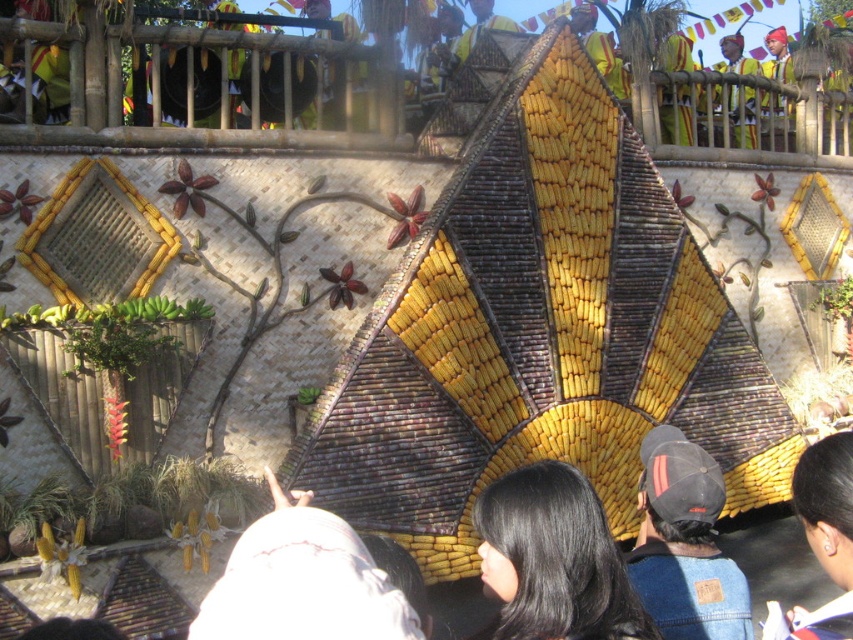
Question: Which object appears farthest from the camera in this image?

Choices:
 (A) denim cap at center
 (B) black hair at upper center
 (C) yellow matte corn at center

Answer: (C)

Question: Does yellow matte corn at center have a lesser width compared to black hair at lower center?

Choices:
 (A) no
 (B) yes

Answer: (A)

Question: Which object is positioned farthest from the black hair at upper center?

Choices:
 (A) yellow fabric headband at upper right
 (B) black hair at lower center
 (C) white fabric at center
 (D) yellow matte corn at center

Answer: (A)

Question: Which point is farther to the camera?

Choices:
 (A) (598, 134)
 (B) (509, 20)
 (C) (242, 572)

Answer: (B)

Question: Does black hair at upper center appear on the left side of white fabric at center?

Choices:
 (A) no
 (B) yes

Answer: (A)

Question: Does denim cap at center appear on the left side of yellow woven fabric at center?

Choices:
 (A) yes
 (B) no

Answer: (B)